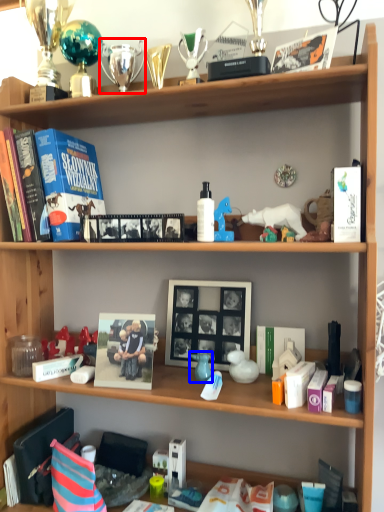
Question: Which of the following is the closest to the observer, toy (highlighted by a red box) or toy (highlighted by a blue box)?

Choices:
 (A) toy
 (B) toy

Answer: (B)